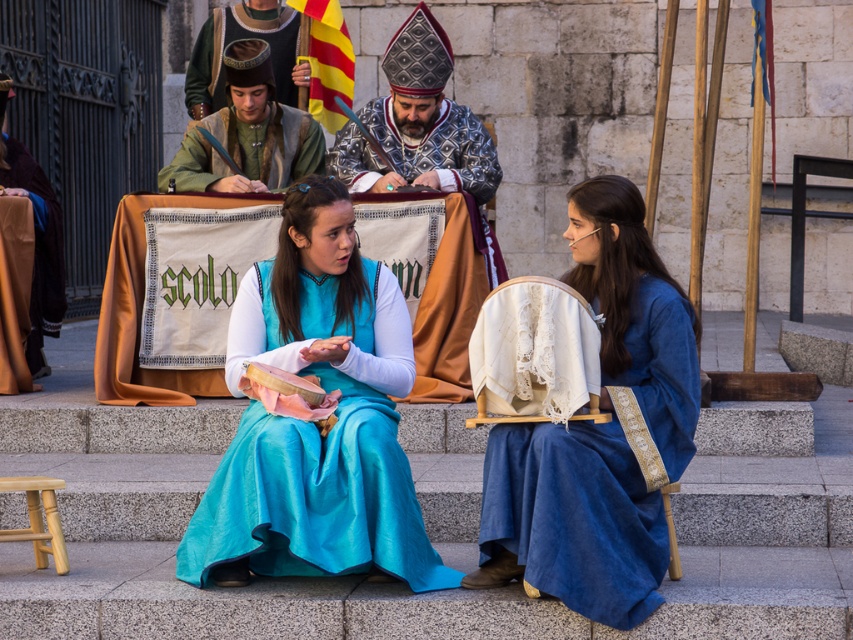
In the scene shown: You are a photographer standing at the base of the stone steps. You want to take a photo that includes both the green woolen tunic at center and the green woolen tunic at upper center. Given the distance between them, will you need to adjust your camera to a wider angle to capture both in the frame?

The distance between the green woolen tunic at center and the green woolen tunic at upper center is 3.27 meters. To capture both in the frame, you would need to adjust your camera to a wider angle to accommodate the space between them.

You are standing at the entrance of the stone wall and want to find the matte blue dress at center. According to the coordinates, where should you look relative to the entrance?

The matte blue dress at center is located at coordinates point (312, 426), which would be to the right and slightly above the entrance.

You are a costume designer observing the two people in the image. You need to determine which costume requires more fabric to make between the blue velvet dress at center and the green woolen tunic at center. Based on their appearance, which one would you choose?

The green woolen tunic at center is thicker than the blue velvet dress at center, so it likely requires more fabric to make.